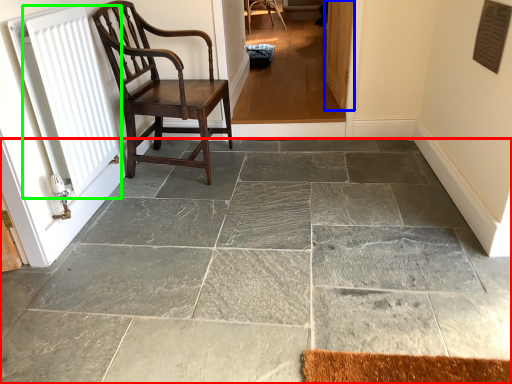
Question: Based on their relative distances, which object is farther from concrete (highlighted by a red box)? Choose from screen door (highlighted by a blue box) and radiator (highlighted by a green box).

Choices:
 (A) screen door
 (B) radiator

Answer: (A)